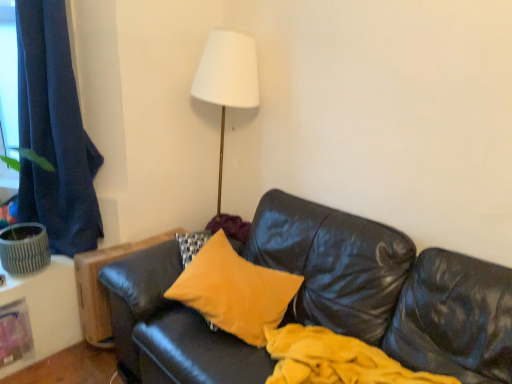
What do you see at coordinates (54, 133) in the screenshot? I see `dark blue fabric curtain at left` at bounding box center [54, 133].

I want to click on dark blue fabric curtain at left, so click(x=54, y=133).

The height and width of the screenshot is (384, 512). What do you see at coordinates (234, 291) in the screenshot?
I see `velvet yellow pillow at center` at bounding box center [234, 291].

In order to face velvet yellow pillow at center, should I rotate leftwards or rightwards?

You should look left and rotate roughly 2.693 degrees.

This screenshot has width=512, height=384. I want to click on velvet yellow pillow at center, so click(234, 291).

Locate an element on the screen. The width and height of the screenshot is (512, 384). dark blue fabric curtain at left is located at coordinates (54, 133).

In the scene shown: Is velvet yellow pillow at center at the right side of dark blue fabric curtain at left?

Correct, you'll find velvet yellow pillow at center to the right of dark blue fabric curtain at left.

Is velvet yellow pillow at center further to camera compared to dark blue fabric curtain at left?

No, velvet yellow pillow at center is in front of dark blue fabric curtain at left.

Considering the points (264, 304) and (26, 193), which point is in front, point (264, 304) or point (26, 193)?

Positioned in front is point (264, 304).

From the image's perspective, relative to dark blue fabric curtain at left, is velvet yellow pillow at center above or below?

From the image's perspective, velvet yellow pillow at center appears below dark blue fabric curtain at left.

From a real-world perspective, is velvet yellow pillow at center on dark blue fabric curtain at left?

No, from a real-world perspective, velvet yellow pillow at center is not above dark blue fabric curtain at left.

Which object is wider, velvet yellow pillow at center or dark blue fabric curtain at left?

With larger width is velvet yellow pillow at center.

Considering the relative sizes of velvet yellow pillow at center and dark blue fabric curtain at left in the image provided, is velvet yellow pillow at center taller than dark blue fabric curtain at left?

No, velvet yellow pillow at center is not taller than dark blue fabric curtain at left.

Considering the sizes of objects velvet yellow pillow at center and dark blue fabric curtain at left in the image provided, who is bigger, velvet yellow pillow at center or dark blue fabric curtain at left?

Bigger between the two is dark blue fabric curtain at left.

Based on the photo, could dark blue fabric curtain at left be considered to be inside velvet yellow pillow at center?

Definitely not — dark blue fabric curtain at left is not inside velvet yellow pillow at center.

Is velvet yellow pillow at center with dark blue fabric curtain at left?

velvet yellow pillow at center and dark blue fabric curtain at left are clearly separated.

Could you tell me if velvet yellow pillow at center is facing dark blue fabric curtain at left?

No, velvet yellow pillow at center is not aimed at dark blue fabric curtain at left.

The height and width of the screenshot is (384, 512). I want to click on pillow below the dark blue fabric curtain at left (from a real-world perspective), so click(234, 291).

Which is more to the left, dark blue fabric curtain at left or velvet yellow pillow at center?

From the viewer's perspective, dark blue fabric curtain at left appears more on the left side.

Which object is further away from the camera taking this photo, dark blue fabric curtain at left or velvet yellow pillow at center?

dark blue fabric curtain at left is further from the camera.

Is point (41, 26) farther from camera compared to point (214, 261)?

Yes, point (41, 26) is behind point (214, 261).

From the image's perspective, is dark blue fabric curtain at left located above or below velvet yellow pillow at center?

Clearly, from the image's perspective, dark blue fabric curtain at left is above velvet yellow pillow at center.

From a real-world perspective, is dark blue fabric curtain at left on top of velvet yellow pillow at center?

Yes.

In terms of width, does dark blue fabric curtain at left look wider or thinner when compared to velvet yellow pillow at center?

In the image, dark blue fabric curtain at left appears to be more narrow than velvet yellow pillow at center.

Is dark blue fabric curtain at left taller than velvet yellow pillow at center?

Yes, dark blue fabric curtain at left is taller than velvet yellow pillow at center.

From the picture: Does dark blue fabric curtain at left have a larger size compared to velvet yellow pillow at center?

Correct, dark blue fabric curtain at left is larger in size than velvet yellow pillow at center.

Would you say dark blue fabric curtain at left is outside velvet yellow pillow at center?

Absolutely, dark blue fabric curtain at left is external to velvet yellow pillow at center.

Is dark blue fabric curtain at left positioned far away from velvet yellow pillow at center?

Actually, dark blue fabric curtain at left and velvet yellow pillow at center are a little close together.

Is dark blue fabric curtain at left looking in the opposite direction of velvet yellow pillow at center?

No.

Locate an element on the screen. curtain located above the velvet yellow pillow at center (from a real-world perspective) is located at coordinates (54, 133).

This screenshot has height=384, width=512. Identify the location of curtain that appears above the velvet yellow pillow at center (from the image's perspective). (54, 133).

Where is `pillow that is on the right side of dark blue fabric curtain at left`? pillow that is on the right side of dark blue fabric curtain at left is located at coordinates (234, 291).